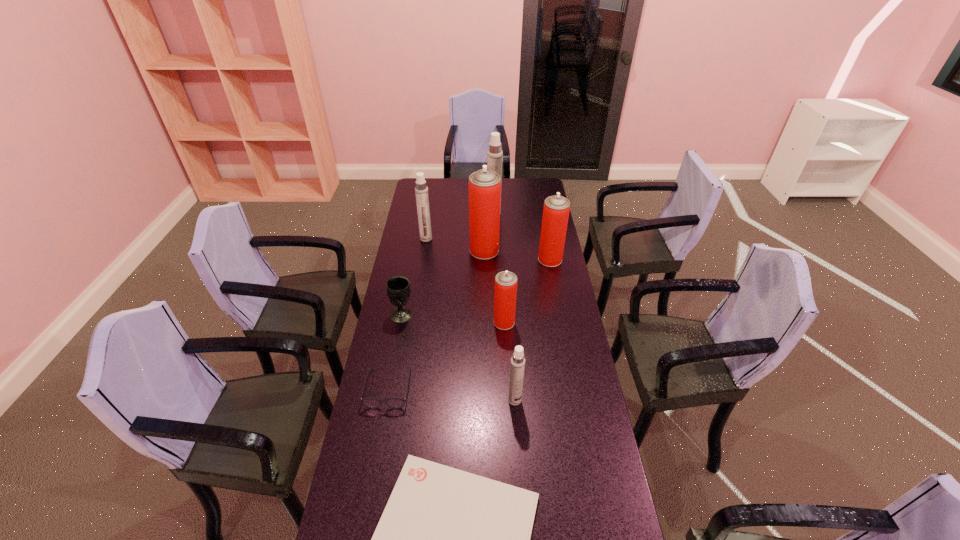
This screenshot has height=540, width=960. I want to click on free space located 0.240m on the front-facing side of the second shortest object, so click(372, 481).

At what (x,y) coordinates should I click in order to perform the action: click on aerosol can positioned at the left edge. Please return your answer as a coordinate pair (x, y). The width and height of the screenshot is (960, 540). Looking at the image, I should click on click(x=421, y=190).

You are a GUI agent. You are given a task and a screenshot of the screen. Output one action in this format:
    pyautogui.click(x=<x>, y=<y>)
    Task: Click on the chalice at the left edge
    This screenshot has height=540, width=960.
    Given the screenshot: What is the action you would take?
    pyautogui.click(x=398, y=287)

At what (x,y) coordinates should I click in order to perform the action: click on spectacles at the left edge. Please return your answer as a coordinate pair (x, y). This screenshot has width=960, height=540. Looking at the image, I should click on (372, 403).

Locate an element on the screen. object located at the right edge is located at coordinates (556, 209).

Identify the location of vacant space at the far edge of the desktop. The height and width of the screenshot is (540, 960). (516, 191).

At what (x,y) coordinates should I click in order to perform the action: click on vacant space at the left edge of the desktop. Please return your answer as a coordinate pair (x, y). Looking at the image, I should click on (378, 366).

This screenshot has height=540, width=960. Identify the location of vacant space at the right edge of the desktop. (553, 320).

I want to click on vacant area that lies between the farthest aerosol can and the rightmost aerosol can, so click(x=522, y=237).

This screenshot has height=540, width=960. I want to click on unoccupied position between the seventh tallest object and the farthest white aerosol can, so click(447, 264).